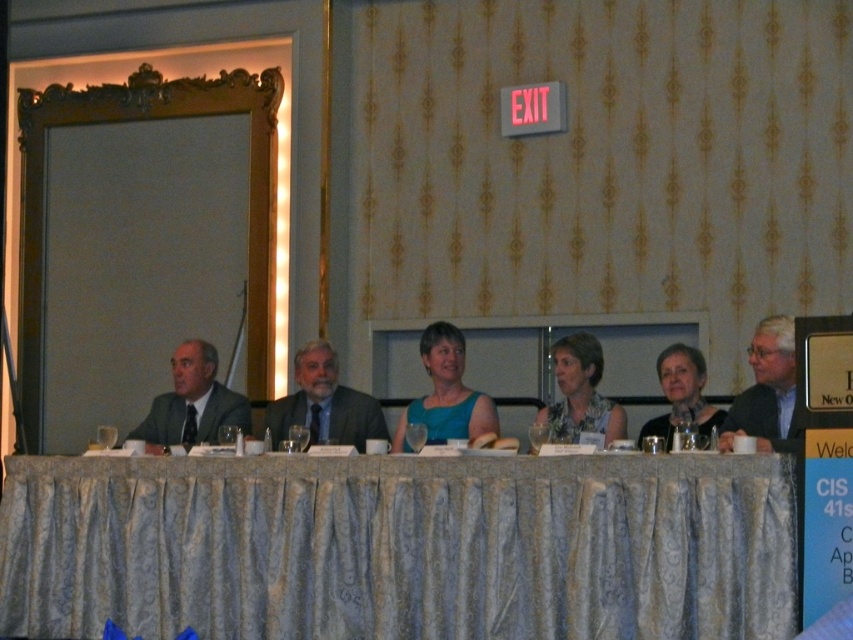
Question: Can you confirm if blue fabric tablecloth at center is thinner than gray suit at center?

Choices:
 (A) no
 (B) yes

Answer: (A)

Question: Does matte gray suit at center come in front of gray suit at left?

Choices:
 (A) no
 (B) yes

Answer: (B)

Question: Which object appears farthest from the camera in this image?

Choices:
 (A) matte gray suit at center
 (B) blue fabric tablecloth at center
 (C) matte blue dress at center

Answer: (A)

Question: Is the position of blue fabric tablecloth at center less distant than that of blue floral dress at center?

Choices:
 (A) yes
 (B) no

Answer: (A)

Question: Which point is farther to the camera?

Choices:
 (A) matte blue dress at center
 (B) matte black dress at center

Answer: (A)

Question: Estimate the real-world distances between objects in this image. Which object is closer to the matte blue dress at center?

Choices:
 (A) blue fabric tablecloth at center
 (B) blue floral dress at center

Answer: (B)